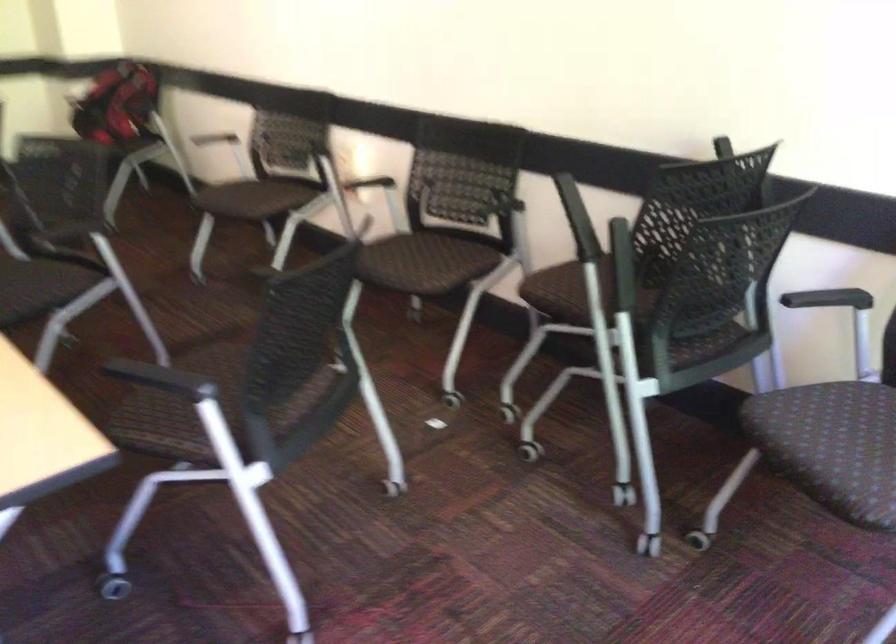
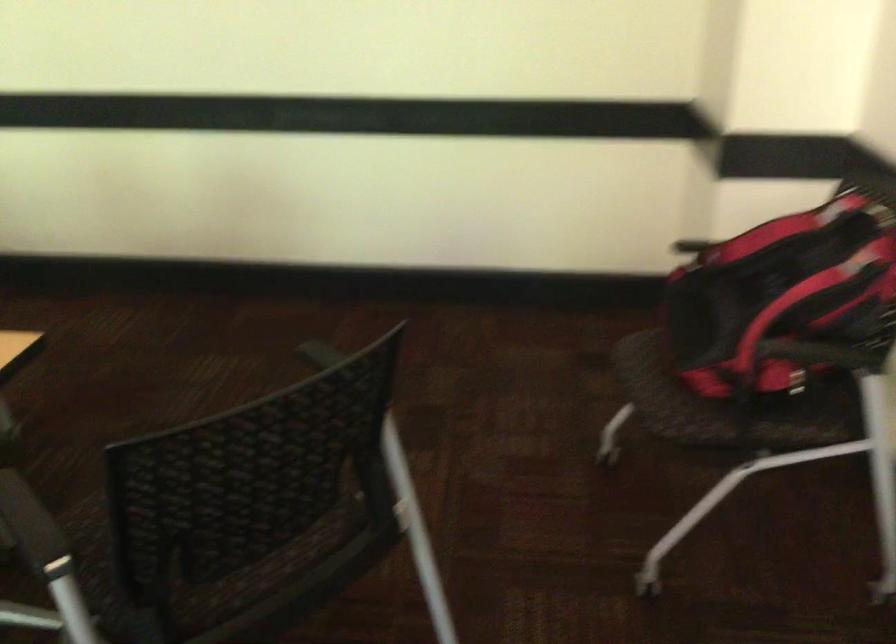
Locate, in the second image, the point that corresponds to (x=80, y=138) in the first image.

(647, 395)